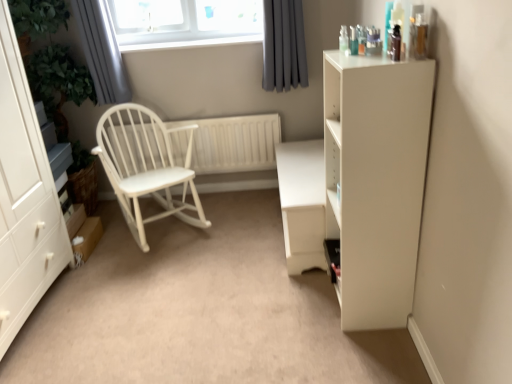
The height and width of the screenshot is (384, 512). I want to click on free location in front of white matte cabinet at right, so click(x=366, y=352).